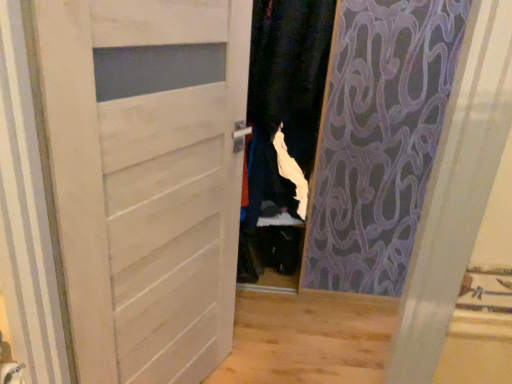
Question: Is white matte door at center in front of or behind white fabric at center in the image?

Choices:
 (A) behind
 (B) front

Answer: (B)

Question: Do you think white matte door at center is within white fabric at center, or outside of it?

Choices:
 (A) inside
 (B) outside

Answer: (B)

Question: Is point (70, 289) positioned closer to the camera than point (320, 33)?

Choices:
 (A) farther
 (B) closer

Answer: (B)

Question: Considering the relative positions of white fabric at center and white matte door at center in the image provided, is white fabric at center to the left or to the right of white matte door at center?

Choices:
 (A) right
 (B) left

Answer: (A)

Question: From the image's perspective, is white fabric at center located above or below white matte door at center?

Choices:
 (A) below
 (B) above

Answer: (B)

Question: In terms of size, does white fabric at center appear bigger or smaller than white matte door at center?

Choices:
 (A) big
 (B) small

Answer: (A)

Question: From a real-world perspective, is white fabric at center above or below white matte door at center?

Choices:
 (A) above
 (B) below

Answer: (A)